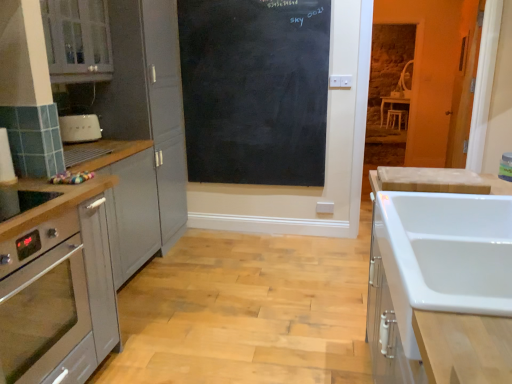
Question: Is white matte toaster at left, the second appliance in the bottom-to-top sequence, oriented towards matte gray cabinet at upper left, the third cabinetry when ordered from right to left?

Choices:
 (A) no
 (B) yes

Answer: (A)

Question: Is white matte toaster at left, the second appliance positioned from the right, at the left side of matte gray cabinet at upper left, the third cabinetry when ordered from right to left?

Choices:
 (A) no
 (B) yes

Answer: (A)

Question: From a real-world perspective, is white matte toaster at left, placed as the second appliance when sorted from front to back, on matte gray cabinet at upper left, the third cabinetry when ordered from right to left?

Choices:
 (A) yes
 (B) no

Answer: (B)

Question: From the image's perspective, is white matte toaster at left, placed as the second appliance when sorted from front to back, on matte gray cabinet at upper left, the third cabinetry when ordered from right to left?

Choices:
 (A) no
 (B) yes

Answer: (A)

Question: Is white matte toaster at left, placed as the 1th appliance when sorted from top to bottom, positioned behind matte gray cabinet at upper left, which is the 1th cabinetry in left-to-right order?

Choices:
 (A) yes
 (B) no

Answer: (A)

Question: Does point (73, 359) appear closer or farther from the camera than point (64, 44)?

Choices:
 (A) closer
 (B) farther

Answer: (A)

Question: Is satin silver cabinet at left, the second cabinetry viewed from the left, to the left or to the right of matte gray cabinet at upper left, which is the 1th cabinetry in left-to-right order, in the image?

Choices:
 (A) right
 (B) left

Answer: (A)

Question: Is satin silver cabinet at left, the 2th cabinetry from the right, inside the boundaries of matte gray cabinet at upper left, the third cabinetry when ordered from right to left, or outside?

Choices:
 (A) inside
 (B) outside

Answer: (B)

Question: In terms of height, does satin silver cabinet at left, the second cabinetry viewed from the left, look taller or shorter compared to matte gray cabinet at upper left, the third cabinetry when ordered from right to left?

Choices:
 (A) tall
 (B) short

Answer: (A)

Question: Is point (56, 278) positioned closer to the camera than point (94, 134)?

Choices:
 (A) farther
 (B) closer

Answer: (B)

Question: Considering the positions of satin silver cabinet at left, the 2th cabinetry from the right, and white matte toaster at left, arranged as the 1th appliance when viewed from the left, in the image, is satin silver cabinet at left, the 2th cabinetry from the right, wider or thinner than white matte toaster at left, arranged as the 1th appliance when viewed from the left,?

Choices:
 (A) thin
 (B) wide

Answer: (B)

Question: From the image's perspective, is satin silver cabinet at left, the second cabinetry viewed from the left, located above or below white matte toaster at left, placed as the 1th appliance when sorted from top to bottom?

Choices:
 (A) below
 (B) above

Answer: (A)

Question: Visually, is satin silver cabinet at left, the 2th cabinetry from the right, positioned to the left or to the right of white matte toaster at left, the second appliance in the bottom-to-top sequence?

Choices:
 (A) left
 (B) right

Answer: (B)

Question: Considering the positions of point (237, 135) and point (88, 61), is point (237, 135) closer or farther from the camera than point (88, 61)?

Choices:
 (A) closer
 (B) farther

Answer: (B)

Question: Considering the positions of black chalkboard at center and matte gray cabinet at upper left, which is the 1th cabinetry in left-to-right order, in the image, is black chalkboard at center wider or thinner than matte gray cabinet at upper left, which is the 1th cabinetry in left-to-right order,?

Choices:
 (A) thin
 (B) wide

Answer: (A)